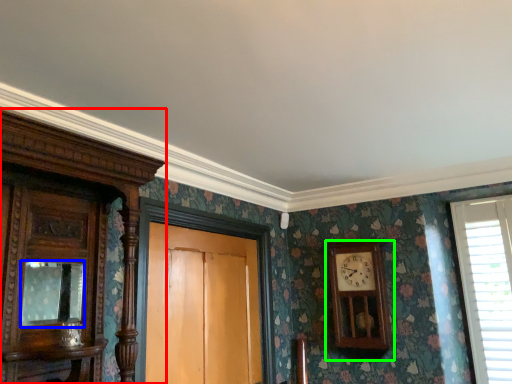
Question: Which object is the farthest from cabinetry (highlighted by a red box)? Choose among these: mirror (highlighted by a blue box) or wall clock (highlighted by a green box).

Choices:
 (A) mirror
 (B) wall clock

Answer: (B)